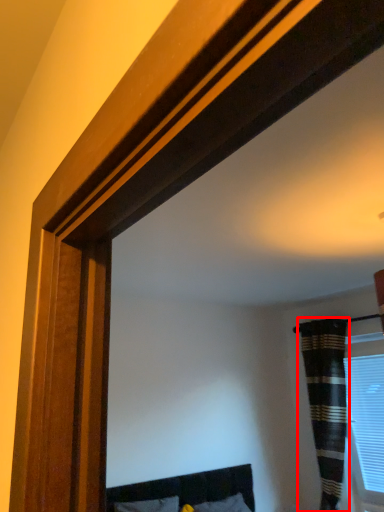
Question: From the image, what is the correct spatial relationship of curtain (annotated by the red box) in relation to window?

Choices:
 (A) right
 (B) left

Answer: (B)